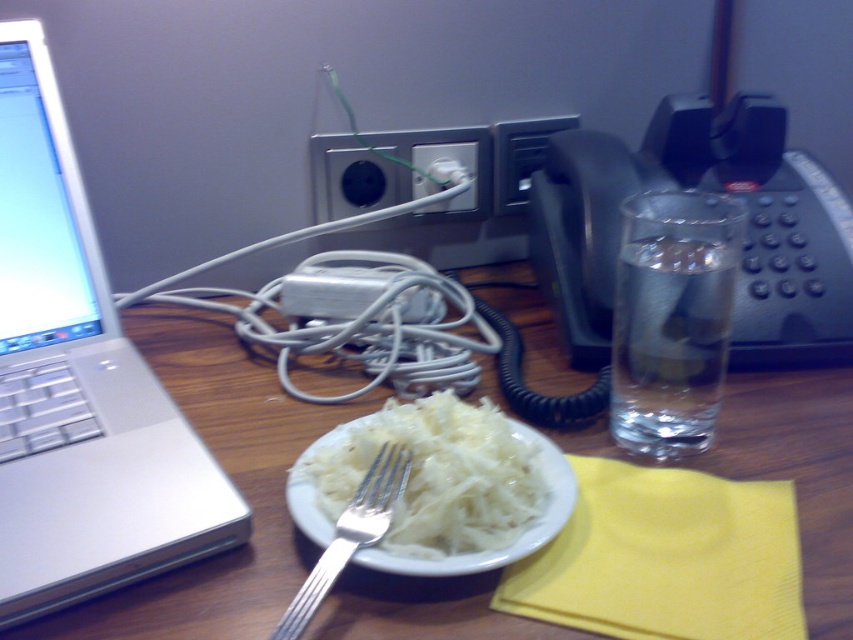
Question: Which object is positioned closest to the silver metallic laptop at left?

Choices:
 (A) white shredded food at center
 (B) black plastic phone at right
 (C) transparent glass water at right
 (D) white plate at center

Answer: (D)

Question: Is black plastic phone at right wider than white shredded food at center?

Choices:
 (A) yes
 (B) no

Answer: (A)

Question: Which point is closer to the camera taking this photo?

Choices:
 (A) (316, 502)
 (B) (164, 339)
 (C) (779, 125)
 (D) (386, 454)

Answer: (A)

Question: Which of the following is the farthest from the observer?

Choices:
 (A) (395, 452)
 (B) (845, 564)
 (C) (543, 502)

Answer: (A)

Question: Observing the image, what is the correct spatial positioning of white plate at center in reference to white shredded food at center?

Choices:
 (A) above
 (B) below

Answer: (A)

Question: Is white plate at center bigger than silver metallic fork at center?

Choices:
 (A) yes
 (B) no

Answer: (A)